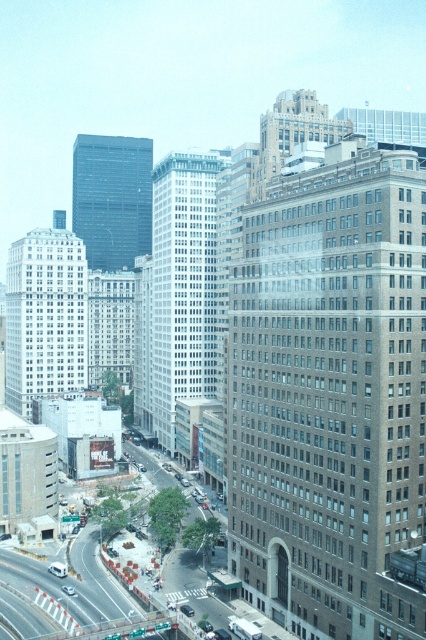
Question: Among these objects, which one is farthest from the camera?

Choices:
 (A) silver metallic sedan at center
 (B) white matte van at lower left

Answer: (B)

Question: Does white matte van at lower left come behind silver metallic sedan at center?

Choices:
 (A) yes
 (B) no

Answer: (A)

Question: Can you confirm if white matte van at lower left is positioned below silver metallic sedan at center?

Choices:
 (A) no
 (B) yes

Answer: (A)

Question: Among these objects, which one is nearest to the camera?

Choices:
 (A) white matte van at lower left
 (B) silver metallic sedan at center

Answer: (B)

Question: Among these objects, which one is nearest to the camera?

Choices:
 (A) silver metallic sedan at center
 (B) white matte van at lower left

Answer: (A)

Question: In this image, where is white matte van at lower left located relative to silver metallic sedan at center?

Choices:
 (A) below
 (B) above

Answer: (B)